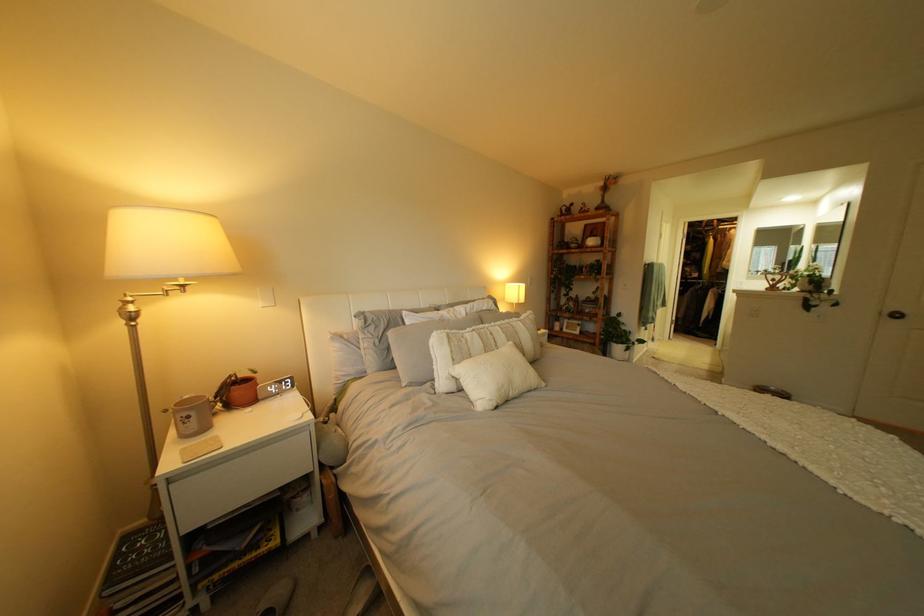
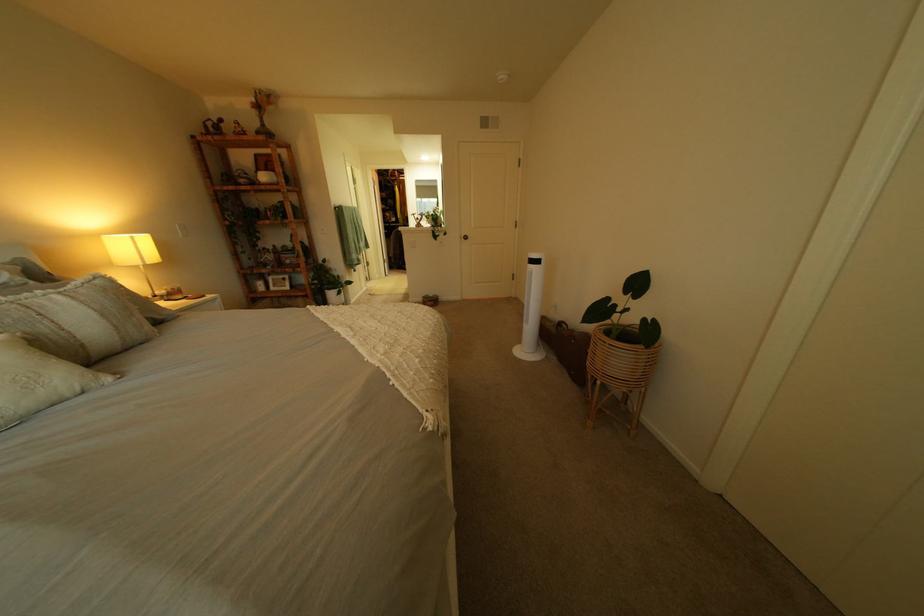
Question: The images are taken continuously from a first-person perspective. In which direction is your viewpoint rotating?

Choices:
 (A) Left
 (B) Right
 (C) Up
 (D) Down

Answer: (B)